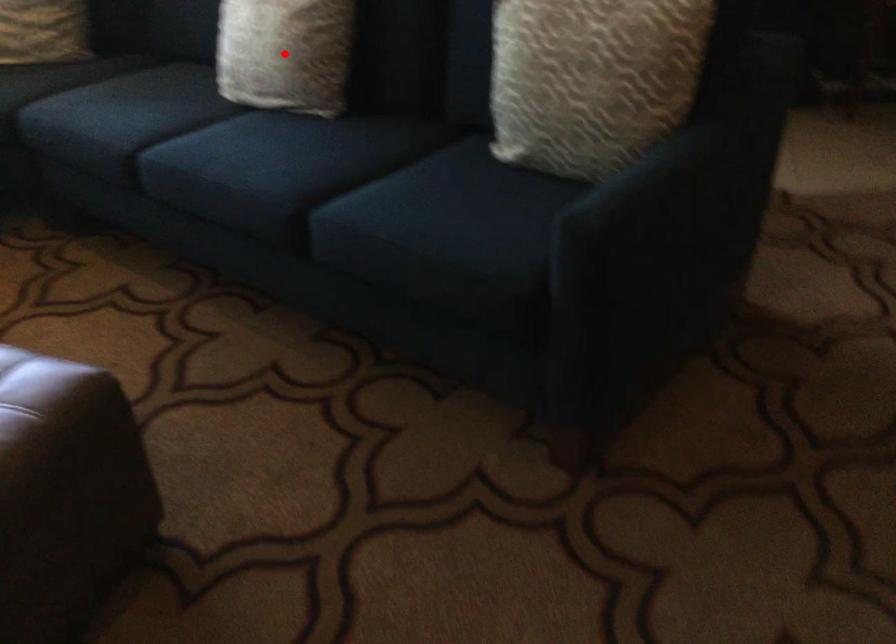
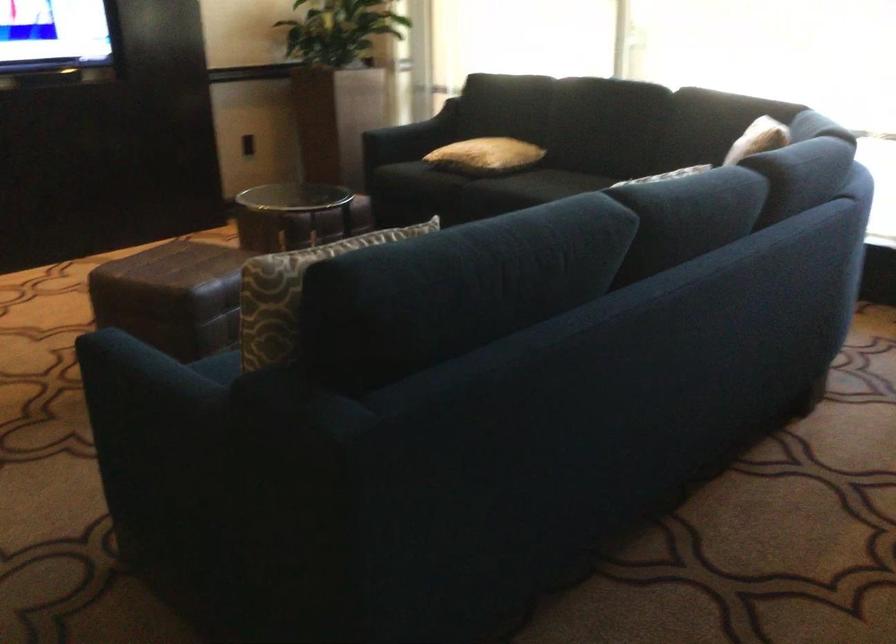
Question: I am providing you with two images of the same scene from different viewpoints. A red point is marked on the first image. Can you still see the location of the red point in image 2?

Choices:
 (A) Yes
 (B) No

Answer: (B)